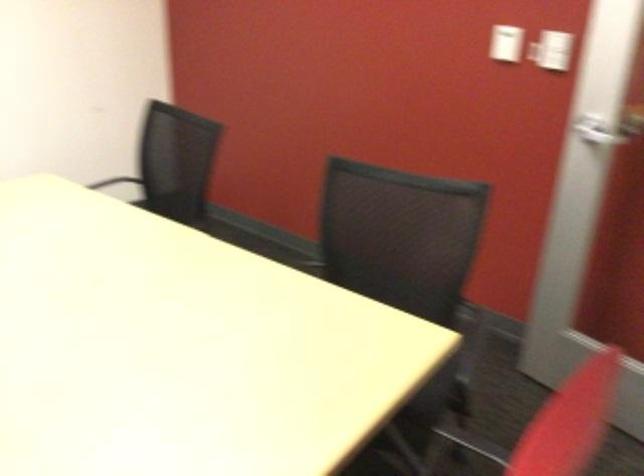
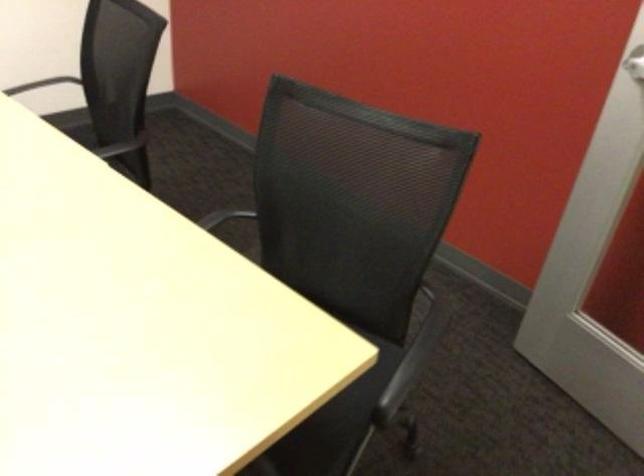
The images are taken continuously from a first-person perspective. In which direction are you moving?

The cameraman walked toward right, forward.